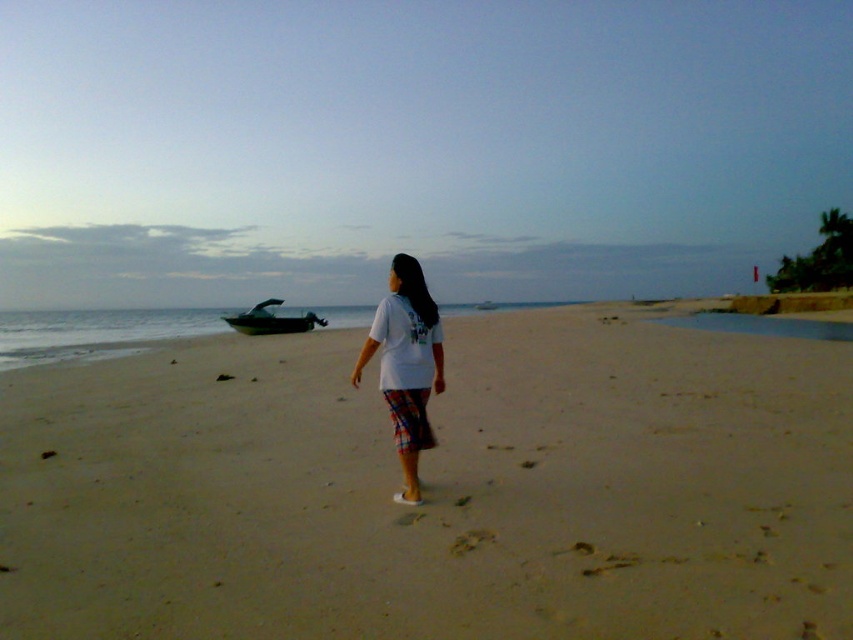
Question: Is white cotton shirt at center above metallic silver boat at left?

Choices:
 (A) yes
 (B) no

Answer: (B)

Question: Which object appears closest to the camera in this image?

Choices:
 (A) white cotton shirt at center
 (B) metallic silver boat at left

Answer: (A)

Question: Is light brown sand at center thinner than white cotton shirt at center?

Choices:
 (A) yes
 (B) no

Answer: (B)

Question: Which object is closer to the camera taking this photo?

Choices:
 (A) light brown sand at center
 (B) white cotton shirt at center
 (C) metallic silver boat at left

Answer: (A)

Question: Which object is the closest to the white cotton shirt at center?

Choices:
 (A) metallic silver boat at left
 (B) light brown sand at center

Answer: (B)

Question: Does light brown sand at center appear on the left side of metallic silver boat at left?

Choices:
 (A) yes
 (B) no

Answer: (B)